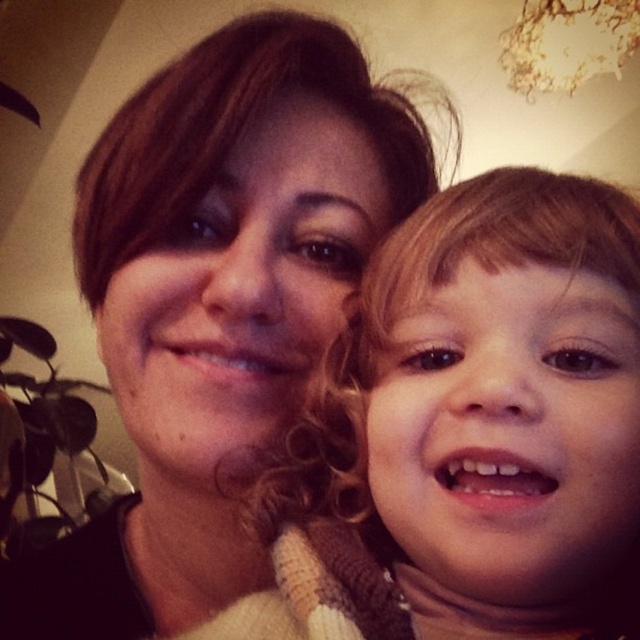
Question: Does smooth beige sweater at center have a lesser width compared to matte brown hair at center?

Choices:
 (A) yes
 (B) no

Answer: (A)

Question: Can you confirm if smooth beige sweater at center is positioned above matte brown hair at center?

Choices:
 (A) yes
 (B) no

Answer: (B)

Question: Which point appears farthest from the camera in this image?

Choices:
 (A) (534, 288)
 (B) (13, 564)

Answer: (B)

Question: Can you confirm if smooth beige sweater at center is wider than matte brown hair at center?

Choices:
 (A) no
 (B) yes

Answer: (A)

Question: Which point is closer to the camera?

Choices:
 (A) matte brown hair at center
 (B) smooth beige sweater at center

Answer: (B)

Question: Which of the following is the farthest from the observer?

Choices:
 (A) matte brown hair at center
 (B) smooth beige sweater at center

Answer: (A)